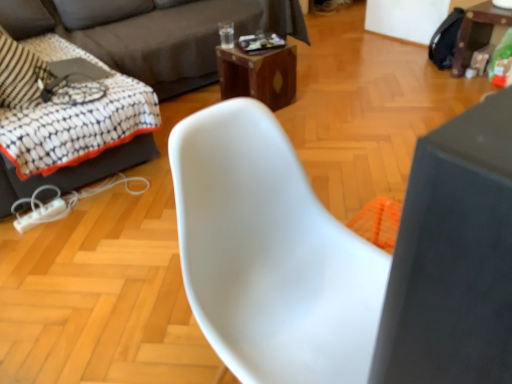
Question: From the image's perspective, would you say dark gray fabric couch at upper left, placed as the second studio couch when sorted from left to right, is shown under wooden table at right, the 2th table positioned from the left?

Choices:
 (A) yes
 (B) no

Answer: (B)

Question: Does dark gray fabric couch at upper left, placed as the second studio couch when sorted from left to right, come behind wooden table at right, the 2th table positioned from the left?

Choices:
 (A) yes
 (B) no

Answer: (B)

Question: Can you confirm if dark gray fabric couch at upper left, placed as the second studio couch when sorted from left to right, is smaller than wooden table at right, the first table viewed from the right?

Choices:
 (A) no
 (B) yes

Answer: (A)

Question: From a real-world perspective, does dark gray fabric couch at upper left, which appears as the 1th studio couch when viewed from the right, sit lower than wooden table at right, the 2th table positioned from the left?

Choices:
 (A) no
 (B) yes

Answer: (A)

Question: Is dark gray fabric couch at upper left, which appears as the 1th studio couch when viewed from the right, turned away from wooden table at right, the first table viewed from the right?

Choices:
 (A) no
 (B) yes

Answer: (A)

Question: Does dark gray fabric couch at upper left, placed as the second studio couch when sorted from left to right, have a lesser height compared to wooden table at right, the first table viewed from the right?

Choices:
 (A) no
 (B) yes

Answer: (A)

Question: Is white plastic chair at center at the left side of wooden table at right, the 2th table positioned from the left?

Choices:
 (A) no
 (B) yes

Answer: (B)

Question: From a real-world perspective, is white plastic chair at center located beneath wooden table at right, the 2th table positioned from the left?

Choices:
 (A) no
 (B) yes

Answer: (A)

Question: Considering the relative sizes of white plastic chair at center and wooden table at right, the first table viewed from the right, in the image provided, is white plastic chair at center shorter than wooden table at right, the first table viewed from the right,?

Choices:
 (A) yes
 (B) no

Answer: (B)

Question: Can you confirm if white plastic chair at center is wider than wooden table at right, the 2th table positioned from the left?

Choices:
 (A) yes
 (B) no

Answer: (A)

Question: Is white plastic chair at center not close to wooden table at right, the 2th table positioned from the left?

Choices:
 (A) yes
 (B) no

Answer: (A)

Question: Is white plastic chair at center facing away from wooden table at right, the first table viewed from the right?

Choices:
 (A) yes
 (B) no

Answer: (B)

Question: Is white plastic swivel chair at left oriented away from dark gray fabric couch at upper left, positioned as the first studio couch in left-to-right order?

Choices:
 (A) no
 (B) yes

Answer: (B)